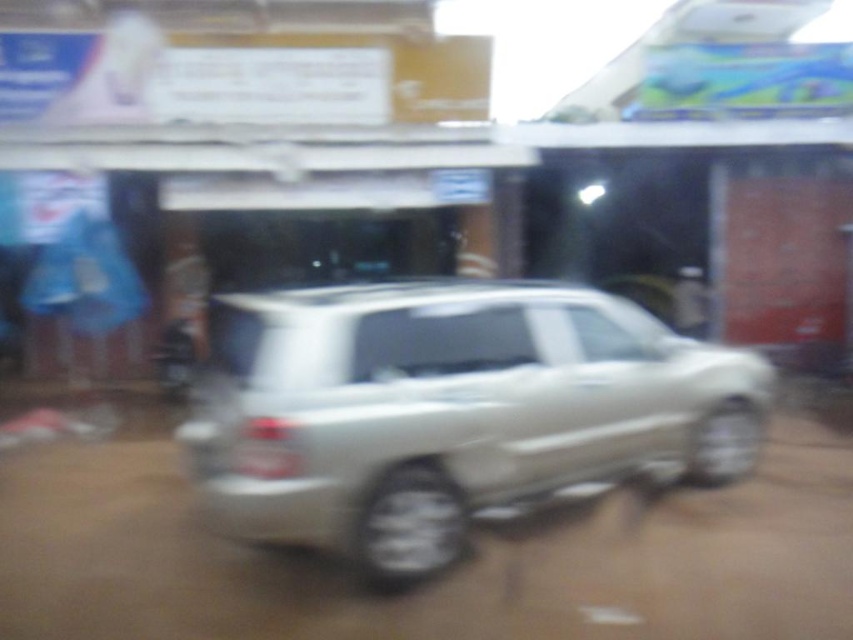
You are a delivery driver who needs to deliver a package to the address on the white plastic license plate at center. However, the license plate is currently obscured by the satin silver suv at center. What should you do to access the license plate?

The white plastic license plate at center is behind the satin silver suv at center, so you need to move the satin silver suv at center to access the license plate.

Based on the photo, you are a delivery driver who needs to park your car in this area. There is a point marked at coordinates (453, 410) which indicates the location of the satin silver suv at center. Can you safely park your vehicle without blocking the entrance of the storefront with the bright blue sign?

The satin silver suv at center is located at the point marked (453, 410). Since the storefront with the bright blue sign is in the background and the SUV is parked in the foreground, it is possible that parking near the SUV might block the entrance of the storefront. However, without knowing the exact position of the entrance relative to the SUV and the blue sign, it is difficult to determine safety. Please check the layout carefully before parking.

You are a delivery driver who needs to attach a GPS tracker to your satin silver suv at center. The GPS tracker must be placed exactly 40 inches away from the white plastic license plate at center. Based on the scene, can you place the tracker on the suv at center?

The satin silver suv at center and white plastic license plate at center are 38.41 inches apart from each other. Since the required distance for the GPS tracker is 40 inches away from the license plate, the current distance is insufficient. Therefore, you cannot place the tracker on the suv at center at the required distance.